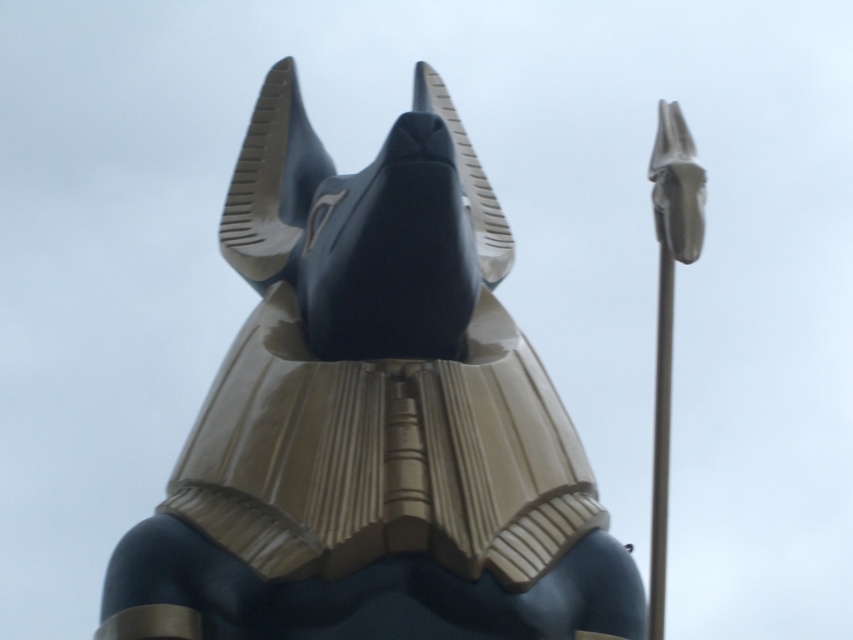
You are standing in front of the statue and want to take a photo of both the glossy gold statue at center and the silver metallic pole at right. If you face the statue, which direction should you turn to include both objects in your camera frame?

Since the glossy gold statue at center is to the left of the silver metallic pole at right, you should turn to your right to include both objects in your camera frame.

Based on the scene description, where is the glossy gold statue at center located in terms of coordinates?

The glossy gold statue at center is located at coordinates point [373,419].